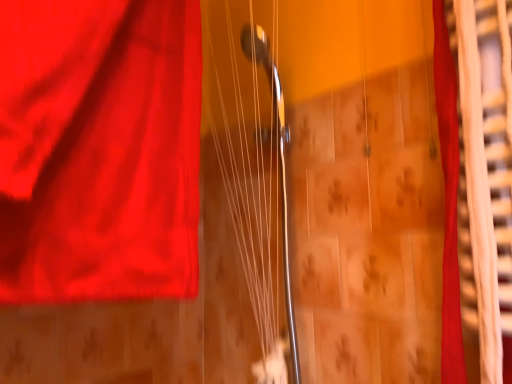
Where is `metallic silver strings at center`? metallic silver strings at center is located at coordinates (246, 203).

Describe the element at coordinates (246, 203) in the screenshot. I see `metallic silver strings at center` at that location.

Measure the distance between metallic silver strings at center and camera.

They are 34.58 inches apart.

Describe the element at coordinates (477, 183) in the screenshot. I see `silky red curtain at right` at that location.

What is the approximate width of silky red curtain at right?

silky red curtain at right is 3.16 inches wide.

At what (x,y) coordinates should I click in order to perform the action: click on silky red curtain at right. Please return your answer as a coordinate pair (x, y). Looking at the image, I should click on [477, 183].

This screenshot has height=384, width=512. I want to click on metallic silver strings at center, so click(x=246, y=203).

Can you confirm if metallic silver strings at center is positioned to the right of silky red curtain at right?

In fact, metallic silver strings at center is to the left of silky red curtain at right.

Is metallic silver strings at center positioned before silky red curtain at right?

No, it is not.

Does point (276, 252) appear closer or farther from the camera than point (493, 29)?

Point (276, 252) appears to be farther away from the viewer than point (493, 29).

From the image's perspective, which one is positioned lower, metallic silver strings at center or silky red curtain at right?

metallic silver strings at center, from the image's perspective.

From a real-world perspective, relative to silky red curtain at right, is metallic silver strings at center vertically above or below?

metallic silver strings at center is situated higher than silky red curtain at right in the real world.

Which of these two, metallic silver strings at center or silky red curtain at right, is thinner?

With smaller width is silky red curtain at right.

Considering the relative sizes of metallic silver strings at center and silky red curtain at right in the image provided, is metallic silver strings at center shorter than silky red curtain at right?

No, metallic silver strings at center is not shorter than silky red curtain at right.

Can you confirm if metallic silver strings at center is bigger than silky red curtain at right?

Indeed, metallic silver strings at center has a larger size compared to silky red curtain at right.

Is silky red curtain at right located within metallic silver strings at center?

Definitely not — silky red curtain at right is not inside metallic silver strings at center.

Consider the image. Is metallic silver strings at center positioned far away from silky red curtain at right?

metallic silver strings at center is near silky red curtain at right, not far away.

Could you tell me if metallic silver strings at center is turned towards silky red curtain at right?

No, metallic silver strings at center is not aimed at silky red curtain at right.

Measure the distance between metallic silver strings at center and silky red curtain at right.

The distance of metallic silver strings at center from silky red curtain at right is 18.57 inches.

Find the location of a particular element. The height and width of the screenshot is (384, 512). string that appears above the silky red curtain at right (from a real-world perspective) is located at coordinates click(246, 203).

Between silky red curtain at right and metallic silver strings at center, which one appears on the left side from the viewer's perspective?

From the viewer's perspective, metallic silver strings at center appears more on the left side.

Is the depth of silky red curtain at right less than that of metallic silver strings at center?

Yes.

Is point (470, 70) positioned behind point (221, 23)?

No, (470, 70) is closer to viewer.

From the image's perspective, does silky red curtain at right appear higher than metallic silver strings at center?

Indeed, from the image's perspective, silky red curtain at right is shown above metallic silver strings at center.

From a real-world perspective, between silky red curtain at right and metallic silver strings at center, who is vertically higher?

metallic silver strings at center, from a real-world perspective.

Based on the photo, considering the relative sizes of silky red curtain at right and metallic silver strings at center in the image provided, is silky red curtain at right thinner than metallic silver strings at center?

Yes.

Is silky red curtain at right taller than metallic silver strings at center?

In fact, silky red curtain at right may be shorter than metallic silver strings at center.

Is silky red curtain at right bigger than metallic silver strings at center?

No.

Is silky red curtain at right situated inside metallic silver strings at center or outside?

silky red curtain at right lies outside metallic silver strings at center.

Would you say silky red curtain at right is a long distance from metallic silver strings at center?

silky red curtain at right is actually quite close to metallic silver strings at center.

Is metallic silver strings at center at the back of silky red curtain at right?

silky red curtain at right does not have its back to metallic silver strings at center.

I want to click on string that is below the silky red curtain at right (from the image's perspective), so click(x=246, y=203).

At what (x,y) coordinates should I click in order to perform the action: click on string on the left of silky red curtain at right. Please return your answer as a coordinate pair (x, y). Looking at the image, I should click on (246, 203).

Image resolution: width=512 pixels, height=384 pixels. I want to click on curtain on the right of metallic silver strings at center, so click(477, 183).